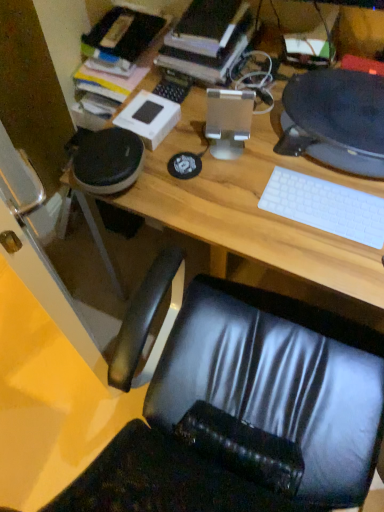
This screenshot has width=384, height=512. In order to click on free space to the left of matte black desktop computer at upper right, which ranks as the second desktop computer in left-to-right order in this screenshot , I will do `click(233, 151)`.